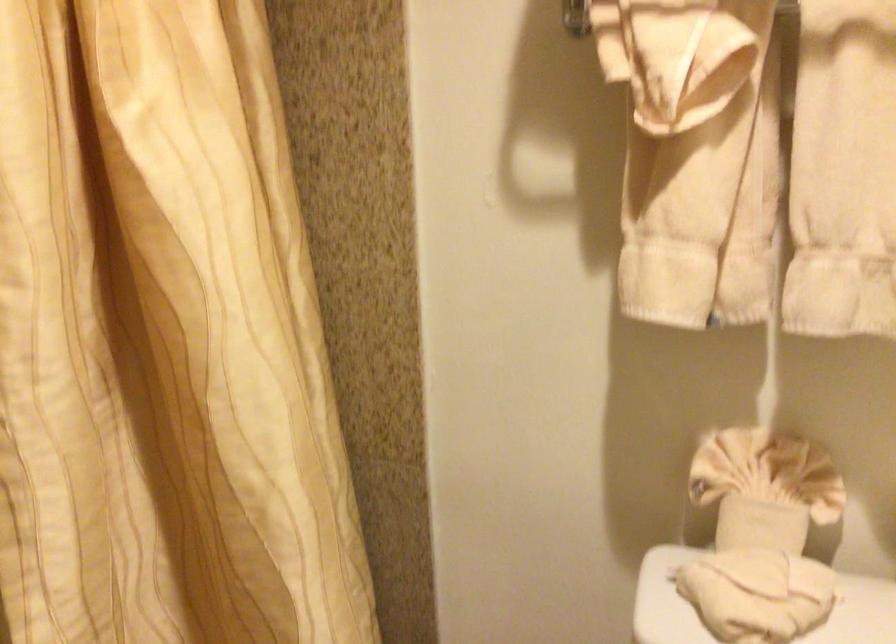
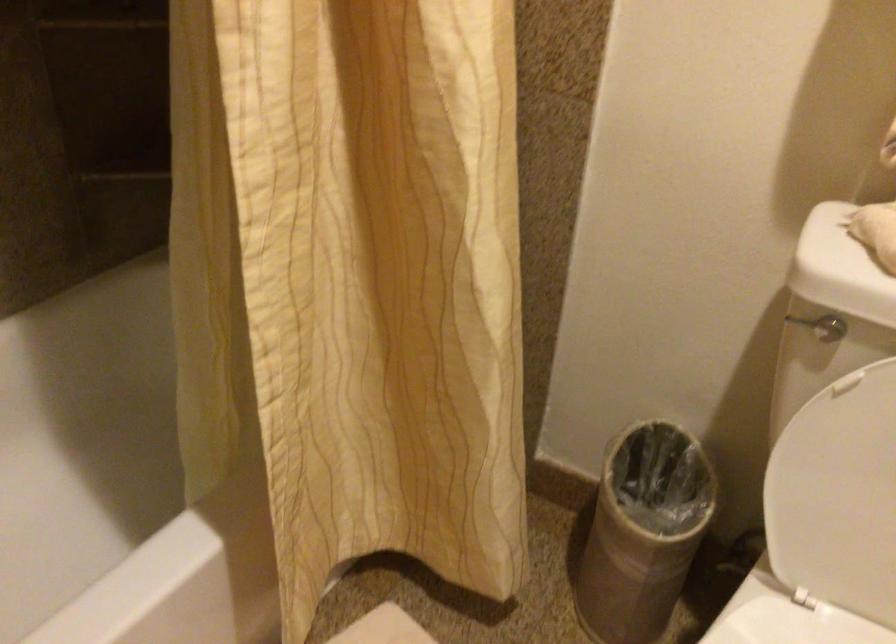
Question: Based on the continuous images, in which direction is the camera rotating? Reply with the corresponding letter.

Choices:
 (A) Left
 (B) Right
 (C) Up
 (D) Down

Answer: (D)